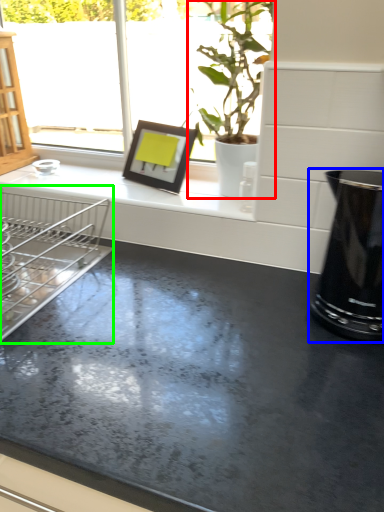
Question: Which object is the closest to the houseplant (highlighted by a red box)? Choose among these: appliance (highlighted by a blue box) or dish washer (highlighted by a green box).

Choices:
 (A) appliance
 (B) dish washer

Answer: (A)